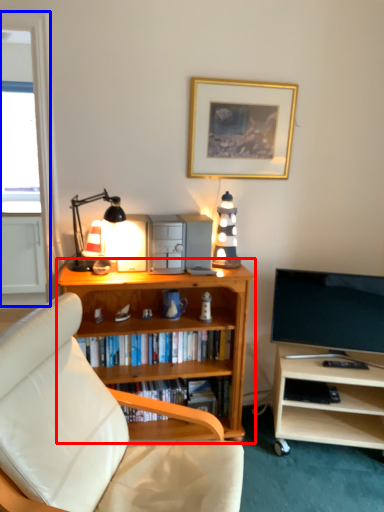
Question: Which point is further to the camera, bookcase (highlighted by a red box) or glass door (highlighted by a blue box)?

Choices:
 (A) bookcase
 (B) glass door

Answer: (A)